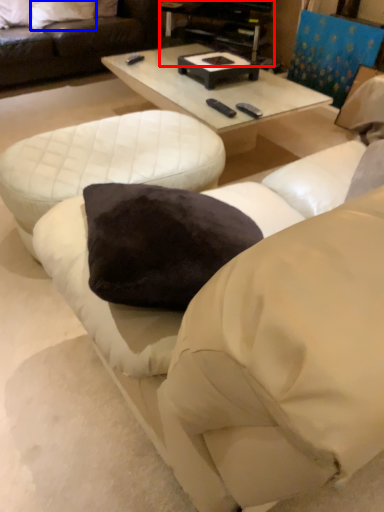
Question: Which point is closer to the camera, entertainment center (highlighted by a red box) or pillow (highlighted by a blue box)?

Choices:
 (A) entertainment center
 (B) pillow

Answer: (A)